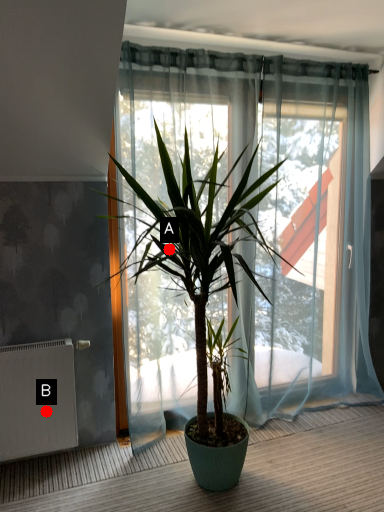
Question: Two points are circled on the image, labeled by A and B beside each circle. Among these points, which one is farthest from the camera?

Choices:
 (A) A is further
 (B) B is further

Answer: (B)